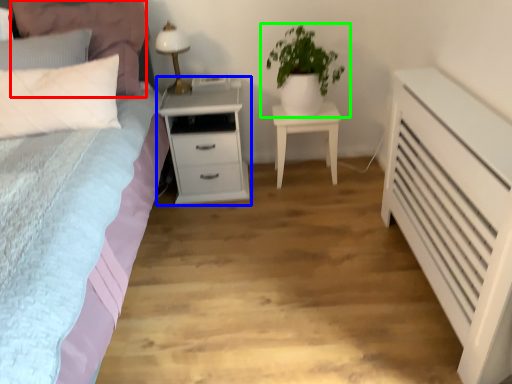
Question: Which object is the farthest from pillow (highlighted by a red box)? Choose among these: nightstand (highlighted by a blue box) or houseplant (highlighted by a green box).

Choices:
 (A) nightstand
 (B) houseplant

Answer: (B)